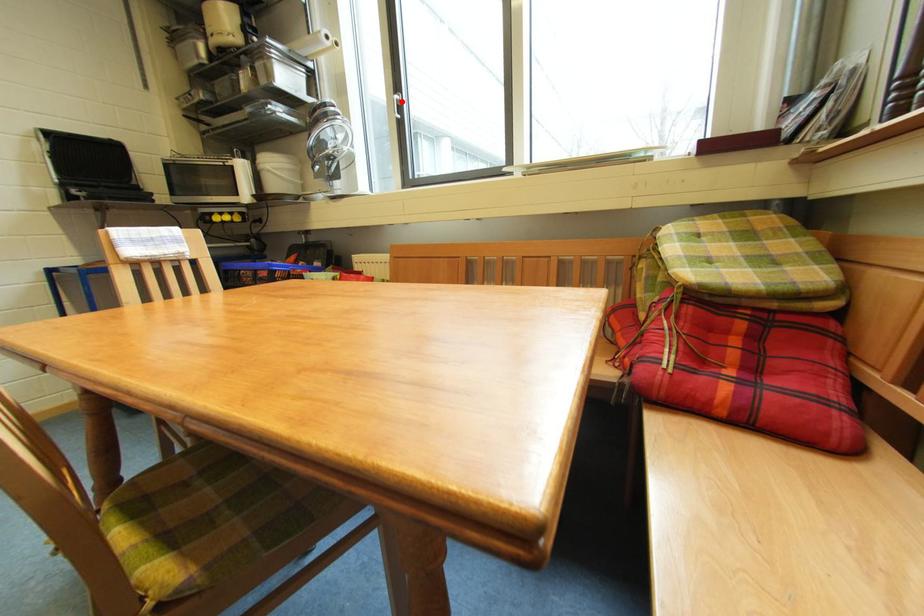
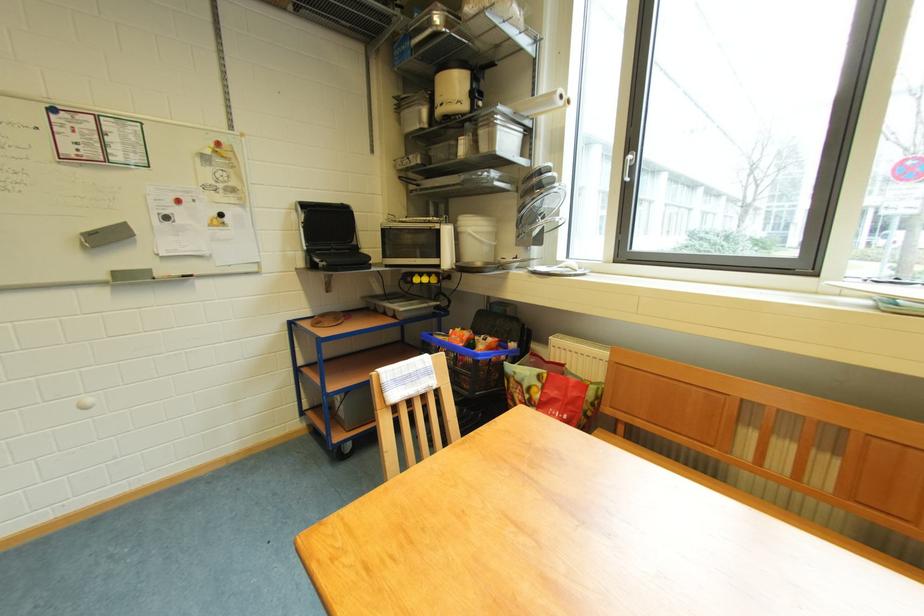
Where in the second image is the point corresponding to the highlighted location from the first image?

(634, 161)